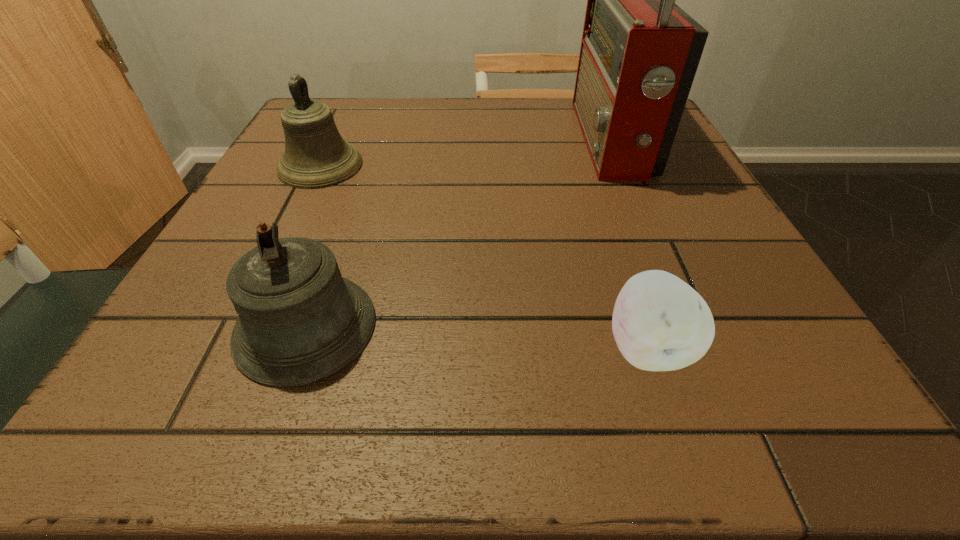
Where is `radio receiver positioned at the far edge`? The width and height of the screenshot is (960, 540). radio receiver positioned at the far edge is located at coordinates (639, 54).

Find the location of a particular element. bell at the far edge is located at coordinates (316, 156).

This screenshot has width=960, height=540. Find the location of `bell at the near edge`. bell at the near edge is located at coordinates (299, 321).

I want to click on apple present at the near edge, so click(x=660, y=323).

Find the location of a particular element. The width and height of the screenshot is (960, 540). radio receiver located in the right edge section of the desktop is located at coordinates (639, 54).

What are the coordinates of `apple at the right edge` in the screenshot? It's located at (660, 323).

This screenshot has width=960, height=540. I want to click on object that is at the far left corner, so click(316, 156).

Identify the location of object that is at the near left corner. The height and width of the screenshot is (540, 960). (299, 321).

Where is `object at the far right corner`? object at the far right corner is located at coordinates (639, 54).

This screenshot has width=960, height=540. Find the location of `object at the near right corner`. object at the near right corner is located at coordinates (660, 323).